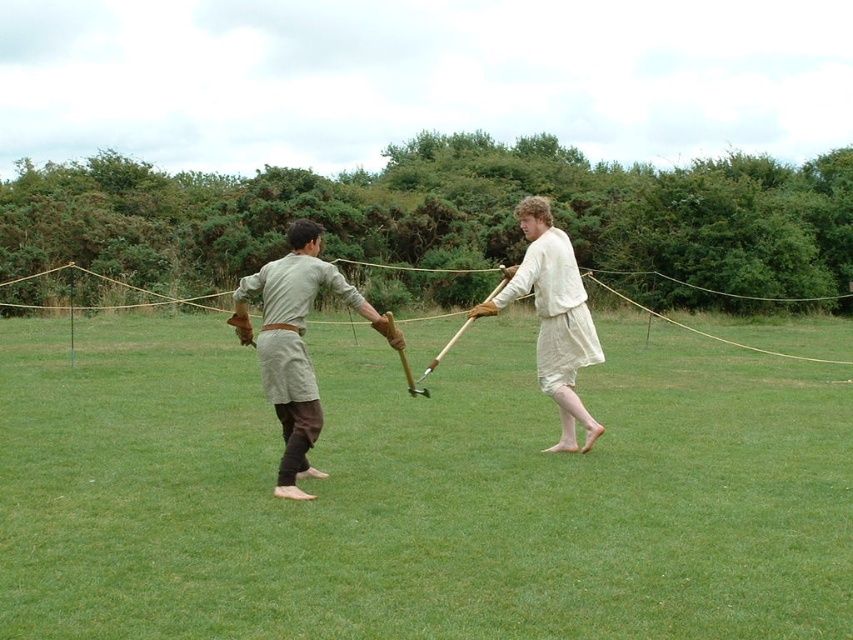
You are a costume designer preparing for a historical play. You need to ensure that the actor wearing the light beige fabric shirt at center and the light beige linen shorts at center has a proper fit. Given that the recommended distance between the shirt and shorts should be between 2.2 and 2.5 meters for the actor to move comfortably, is the current distance acceptable?

The light beige fabric shirt at center and light beige linen shorts at center are 2.38 meters apart, which falls within the recommended range of 2.2 to 2.5 meters. Therefore, the current distance is acceptable for comfortable movement.

You are a medieval knight in the scene. You need to retrieve the light beige fabric sword at center. Can you step onto the green grass at center to reach it?

The green grass at center is positioned under light beige fabric sword at center, so stepping onto the green grass at center would place you directly beneath the sword. You might need to reach upward to grasp it.

Consider the image. You are a costume designer observing the image. You need to ensure that the fabric sword and shirt are positioned correctly for a performance. According to the scene, which object is lower in position between the light beige fabric sword at center and the light beige fabric shirt at center?

The light beige fabric sword at center is located below the light beige fabric shirt at center, so the sword is lower than the shirt.